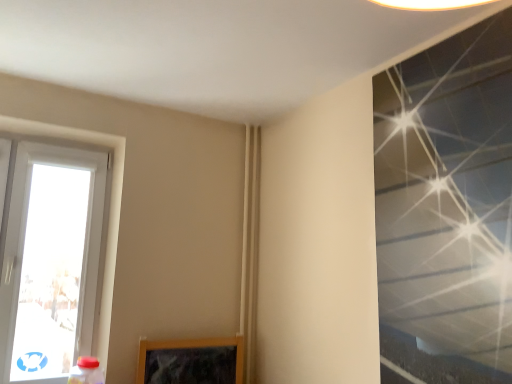
Describe the element at coordinates (49, 259) in the screenshot. I see `white plastic window at left, which appears as the first window when viewed from the back` at that location.

Identify the location of white plastic window at left, which appears as the first window when viewed from the back. Image resolution: width=512 pixels, height=384 pixels. (49, 259).

You are a GUI agent. You are given a task and a screenshot of the screen. Output one action in this format:
    pyautogui.click(x=<x>, y=<y>)
    Task: Click on the transparent glass window at upper right, the first window positioned from the front
    The image size is (512, 384).
    Given the screenshot: What is the action you would take?
    pyautogui.click(x=446, y=209)

The height and width of the screenshot is (384, 512). What do you see at coordinates (446, 209) in the screenshot?
I see `transparent glass window at upper right, the first window viewed from the right` at bounding box center [446, 209].

You are a GUI agent. You are given a task and a screenshot of the screen. Output one action in this format:
    pyautogui.click(x=<x>, y=<y>)
    Task: Click on the white plastic window at left, the 2th window positioned from the front
    The image size is (512, 384).
    Given the screenshot: What is the action you would take?
    pyautogui.click(x=49, y=259)

Considering the relative positions of white plastic window at left, the 1th window from the left, and transparent glass window at upper right, the first window viewed from the right, in the image provided, is white plastic window at left, the 1th window from the left, to the left or to the right of transparent glass window at upper right, the first window viewed from the right,?

Clearly, white plastic window at left, the 1th window from the left, is on the left of transparent glass window at upper right, the first window viewed from the right, in the image.

Is white plastic window at left, the second window in the right-to-left sequence, in front of or behind transparent glass window at upper right, the first window positioned from the front, in the image?

white plastic window at left, the second window in the right-to-left sequence, is positioned farther from the viewer than transparent glass window at upper right, the first window positioned from the front.

Is point (74, 207) behind point (452, 172)?

Yes, point (74, 207) is behind point (452, 172).

From the image's perspective, does white plastic window at left, the 2th window positioned from the front, appear lower than transparent glass window at upper right, the first window positioned from the front?

Correct, white plastic window at left, the 2th window positioned from the front, appears lower than transparent glass window at upper right, the first window positioned from the front, in the image.

From a real-world perspective, is white plastic window at left, the 2th window positioned from the front, positioned under transparent glass window at upper right, the first window positioned from the front, based on gravity?

Correct, in the physical world, white plastic window at left, the 2th window positioned from the front, is lower than transparent glass window at upper right, the first window positioned from the front.

Considering the relative sizes of white plastic window at left, the 2th window positioned from the front, and transparent glass window at upper right, the first window viewed from the right, in the image provided, is white plastic window at left, the 2th window positioned from the front, thinner than transparent glass window at upper right, the first window viewed from the right,?

No, white plastic window at left, the 2th window positioned from the front, is not thinner than transparent glass window at upper right, the first window viewed from the right.

Considering the relative sizes of white plastic window at left, the 2th window positioned from the front, and transparent glass window at upper right, which ranks as the 2th window in back-to-front order, in the image provided, is white plastic window at left, the 2th window positioned from the front, shorter than transparent glass window at upper right, which ranks as the 2th window in back-to-front order,?

Yes.

Which of these two, white plastic window at left, the second window in the right-to-left sequence, or transparent glass window at upper right, which ranks as the 2th window in back-to-front order, is smaller?

With smaller size is transparent glass window at upper right, which ranks as the 2th window in back-to-front order.

Is white plastic window at left, the 2th window positioned from the front, completely or partially outside of transparent glass window at upper right, which ranks as the 2th window in back-to-front order?

That's correct, white plastic window at left, the 2th window positioned from the front, is outside of transparent glass window at upper right, which ranks as the 2th window in back-to-front order.

Is white plastic window at left, which appears as the first window when viewed from the back, directly adjacent to transparent glass window at upper right, which ranks as the 2th window in back-to-front order?

They are not placed beside each other.

Is white plastic window at left, the 1th window from the left, oriented towards transparent glass window at upper right, which ranks as the 2th window in back-to-front order?

No, white plastic window at left, the 1th window from the left, does not turn towards transparent glass window at upper right, which ranks as the 2th window in back-to-front order.

Can you tell me how much white plastic window at left, which appears as the first window when viewed from the back, and transparent glass window at upper right, the first window viewed from the right, differ in facing direction?

The angle between the facing direction of white plastic window at left, which appears as the first window when viewed from the back, and the facing direction of transparent glass window at upper right, the first window viewed from the right, is 89.7 degrees.

Where is `window above the white plastic window at left, the second window in the right-to-left sequence (from the image's perspective)`? The width and height of the screenshot is (512, 384). window above the white plastic window at left, the second window in the right-to-left sequence (from the image's perspective) is located at coordinates (446, 209).

Consider the image. Between transparent glass window at upper right, which ranks as the 2th window in back-to-front order, and white plastic window at left, the 1th window from the left, which one appears on the right side from the viewer's perspective?

transparent glass window at upper right, which ranks as the 2th window in back-to-front order, is more to the right.

Which object is further away from the camera, transparent glass window at upper right, the first window viewed from the right, or white plastic window at left, the second window in the right-to-left sequence?

white plastic window at left, the second window in the right-to-left sequence, is more distant.

Between point (461, 286) and point (18, 353), which one is positioned behind?

The point (18, 353) is more distant.

From the image's perspective, which one is positioned lower, transparent glass window at upper right, the first window viewed from the right, or white plastic window at left, which appears as the first window when viewed from the back?

white plastic window at left, which appears as the first window when viewed from the back, from the image's perspective.

From a real-world perspective, does transparent glass window at upper right, which ranks as the 2th window in back-to-front order, stand above white plastic window at left, which appears as the first window when viewed from the back?

Correct, in the physical world, transparent glass window at upper right, which ranks as the 2th window in back-to-front order, is higher than white plastic window at left, which appears as the first window when viewed from the back.

Looking at their sizes, would you say transparent glass window at upper right, the first window positioned from the front, is wider or thinner than white plastic window at left, the 2th window positioned from the front?

Considering their sizes, transparent glass window at upper right, the first window positioned from the front, looks slimmer than white plastic window at left, the 2th window positioned from the front.

Based on the photo, considering the sizes of objects transparent glass window at upper right, which ranks as the 2th window in back-to-front order, and white plastic window at left, the second window in the right-to-left sequence, in the image provided, who is taller, transparent glass window at upper right, which ranks as the 2th window in back-to-front order, or white plastic window at left, the second window in the right-to-left sequence,?

transparent glass window at upper right, which ranks as the 2th window in back-to-front order, is taller.

Which of these two, transparent glass window at upper right, the first window positioned from the front, or white plastic window at left, the 2th window positioned from the front, is bigger?

With larger size is white plastic window at left, the 2th window positioned from the front.

Is transparent glass window at upper right, which ranks as the 2th window in back-to-front order, spatially inside white plastic window at left, the 1th window from the left, or outside of it?

The correct answer is: outside.

Are transparent glass window at upper right, the first window positioned from the front, and white plastic window at left, the second window in the right-to-left sequence, beside each other?

No, transparent glass window at upper right, the first window positioned from the front, is not touching white plastic window at left, the second window in the right-to-left sequence.

Is transparent glass window at upper right, which ranks as the 2th window in back-to-front order, oriented towards white plastic window at left, the 1th window from the left?

No, transparent glass window at upper right, which ranks as the 2th window in back-to-front order, is not oriented towards white plastic window at left, the 1th window from the left.

How distant is transparent glass window at upper right, which ranks as the 2th window in back-to-front order, from white plastic window at left, the second window in the right-to-left sequence?

They are 6.05 feet apart.

You are a GUI agent. You are given a task and a screenshot of the screen. Output one action in this format:
    pyautogui.click(x=<x>, y=<y>)
    Task: Click on the window lying above the white plastic window at left, the second window in the right-to-left sequence (from the image's perspective)
    The height and width of the screenshot is (384, 512).
    Given the screenshot: What is the action you would take?
    (x=446, y=209)

Identify the location of window in front of the white plastic window at left, the 1th window from the left. (446, 209).

Where is `window on the left of transparent glass window at upper right, the first window viewed from the right`? window on the left of transparent glass window at upper right, the first window viewed from the right is located at coordinates (49, 259).